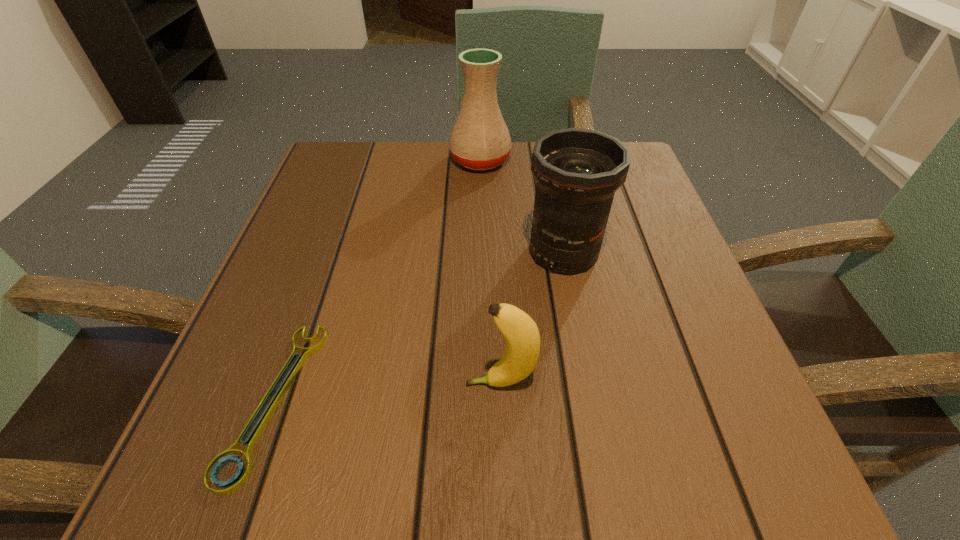
The image size is (960, 540). I want to click on pottery, so click(480, 140).

Where is `the third nearest object`? The width and height of the screenshot is (960, 540). the third nearest object is located at coordinates (577, 171).

This screenshot has width=960, height=540. Find the location of `the rightmost object`. the rightmost object is located at coordinates (577, 171).

The image size is (960, 540). I want to click on banana, so click(521, 334).

Find the location of a particular element. the leftmost object is located at coordinates (213, 469).

Locate an element on the screen. This screenshot has height=540, width=960. wrench is located at coordinates click(213, 469).

Where is `free space located on the left of the farthest object`? This screenshot has height=540, width=960. free space located on the left of the farthest object is located at coordinates (376, 160).

I want to click on blank space located on the left of the telephoto lens, so click(x=479, y=252).

You are a GUI agent. You are given a task and a screenshot of the screen. Output one action in this format:
    pyautogui.click(x=<x>, y=<y>)
    Task: Click on the free space located 0.310m from the stem of the banana
    Image resolution: width=960 pixels, height=540 pixels.
    Given the screenshot: What is the action you would take?
    pyautogui.click(x=244, y=383)

Find the location of a particular element. The width and height of the screenshot is (960, 540). free space located 0.220m from the stem of the banana is located at coordinates (308, 383).